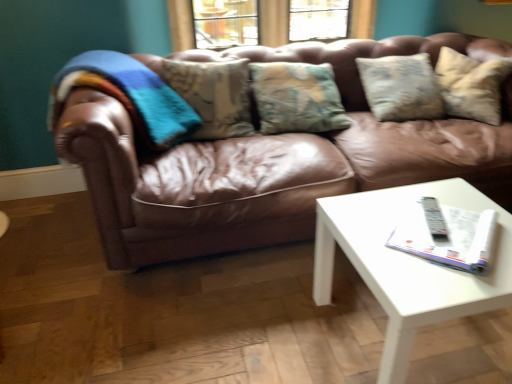
Question: Is point (231, 139) closer or farther from the camera than point (367, 240)?

Choices:
 (A) closer
 (B) farther

Answer: (B)

Question: Based on their sizes in the image, would you say brown leather couch at center is bigger or smaller than white glossy coffee table at lower right?

Choices:
 (A) big
 (B) small

Answer: (A)

Question: Estimate the real-world distances between objects in this image. Which object is closer to the brown leather couch at center?

Choices:
 (A) white glossy coffee table at lower right
 (B) white glossy magazine at center right

Answer: (A)

Question: Which object is the closest to the white glossy coffee table at lower right?

Choices:
 (A) brown leather couch at center
 (B) white glossy magazine at center right

Answer: (B)